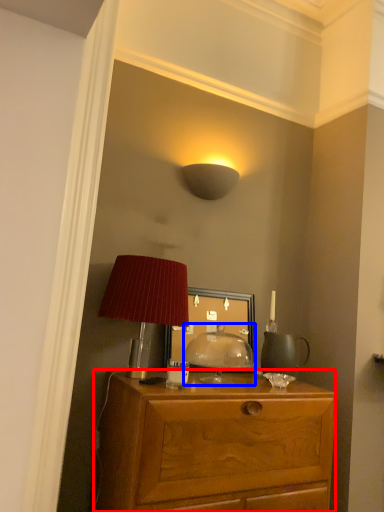
Question: Which point is further to the camera, desk (highlighted by a red box) or table lamp (highlighted by a blue box)?

Choices:
 (A) desk
 (B) table lamp

Answer: (B)